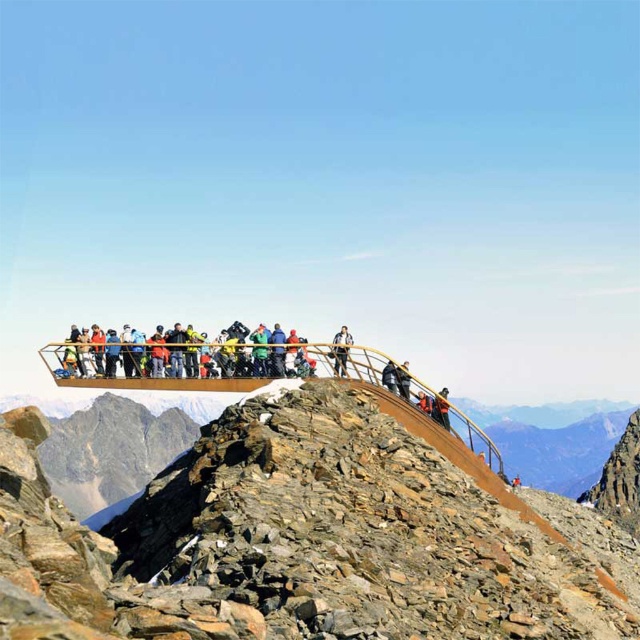
Is point (369, 426) positioned after point (444, 401)?

That is False.

Is rustic stone mountain at upper center positioned at the back of orange life vest at center?

No, rustic stone mountain at upper center is closer to the viewer.

What are the coordinates of `rustic stone mountain at upper center` in the screenshot? It's located at (305, 541).

From the picture: Does matte black jacket at center appear under orange life vest at center?

No, matte black jacket at center is not below orange life vest at center.

Who is higher up, matte black jacket at center or orange life vest at center?

matte black jacket at center is above.

Between point (221, 340) and point (440, 392), which one is positioned in front?

Point (221, 340)

Where is `matte black jacket at center`? matte black jacket at center is located at coordinates (227, 355).

Who is positioned more to the right, matte black jacket at center or dark gray fabric jacket at center?

dark gray fabric jacket at center is more to the right.

Is point (272, 342) in front of point (401, 385)?

Yes, it is in front of point (401, 385).

Is point (182, 369) positioned after point (401, 387)?

Yes.

Where is `matte black jacket at center`? This screenshot has height=640, width=640. matte black jacket at center is located at coordinates (227, 355).